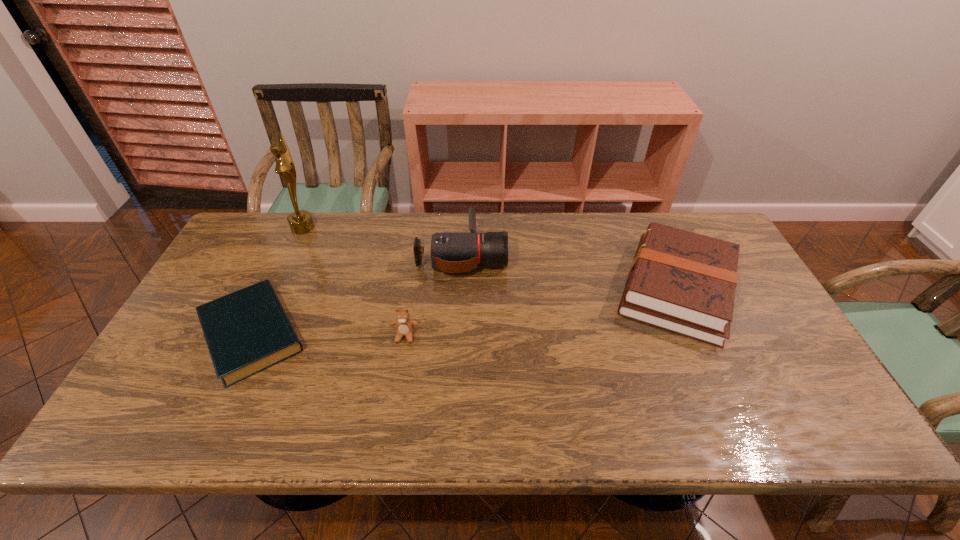
Find the location of `free point located 0.090m on the front-facing side of the teddy bear`. free point located 0.090m on the front-facing side of the teddy bear is located at coordinates (399, 374).

Locate an element on the screen. vacant space located on the back of the left book is located at coordinates (300, 232).

Locate an element on the screen. The width and height of the screenshot is (960, 540). award that is at the far edge is located at coordinates (300, 222).

At what (x,y) coordinates should I click in order to perform the action: click on camcorder that is at the far edge. Please return your answer as a coordinate pair (x, y). This screenshot has width=960, height=540. Looking at the image, I should click on (450, 252).

Locate an element on the screen. Image resolution: width=960 pixels, height=540 pixels. hardback book that is at the far edge is located at coordinates (683, 282).

Identify the location of award positioned at the left edge. (300, 222).

Find the location of a particular element. Image resolution: width=960 pixels, height=540 pixels. book located at the left edge is located at coordinates (247, 331).

This screenshot has width=960, height=540. I want to click on object situated at the right edge, so click(x=683, y=282).

Locate an element on the screen. This screenshot has width=960, height=540. object that is positioned at the far left corner is located at coordinates (300, 222).

Where is `object at the far right corner`? Image resolution: width=960 pixels, height=540 pixels. object at the far right corner is located at coordinates (683, 282).